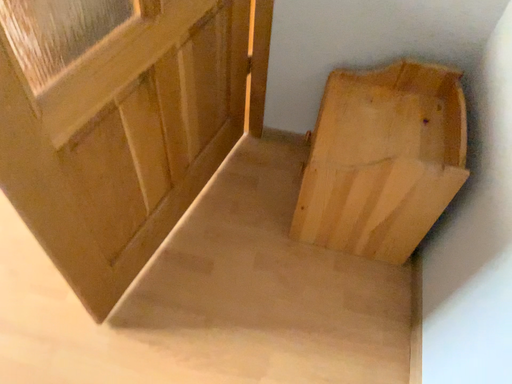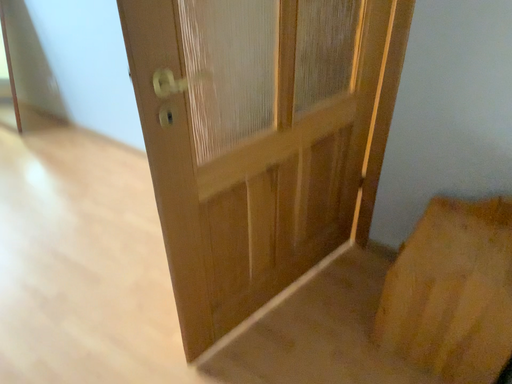
Question: Which way did the camera rotate in the video?

Choices:
 (A) rotated left
 (B) rotated right

Answer: (A)